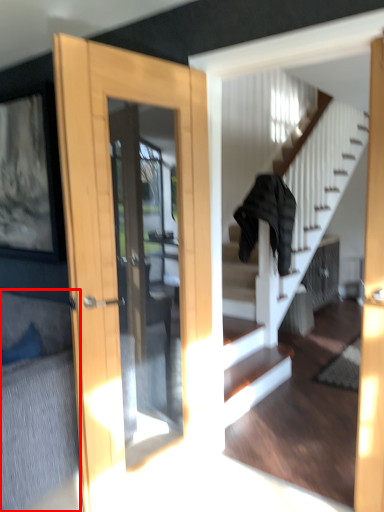
Question: From the image's perspective, where is couch (annotated by the red box) located in relation to clothing in the image?

Choices:
 (A) below
 (B) above

Answer: (A)